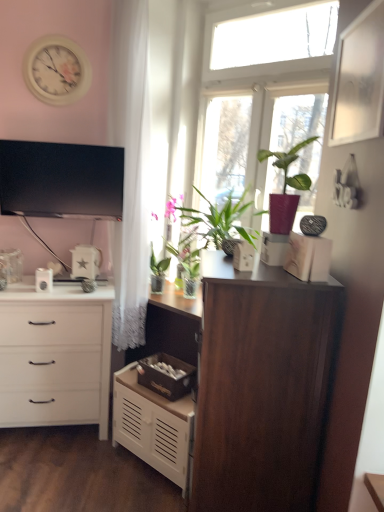
Question: Is white glossy star-shaped object at center, placed as the 2th appliance when sorted from right to left, in front of or behind white glossy toaster at center, which is the 1th appliance in front-to-back order, in the image?

Choices:
 (A) front
 (B) behind

Answer: (B)

Question: Considering the positions of white glossy star-shaped object at center, placed as the 2th appliance when sorted from right to left, and white glossy toaster at center, which is counted as the 1th appliance, starting from the right, in the image, is white glossy star-shaped object at center, placed as the 2th appliance when sorted from right to left, wider or thinner than white glossy toaster at center, which is counted as the 1th appliance, starting from the right,?

Choices:
 (A) thin
 (B) wide

Answer: (B)

Question: Which is farther from the clear glass window at upper center?

Choices:
 (A) black glossy tv at upper left
 (B) white glossy kettle at left, which is counted as the second appliance, starting from the front
 (C) white matte chest of drawers at lower center, which is the 1th chest of drawers in right-to-left order
 (D) brown wooden storage box at center, the 2th storage box from the front
 (E) white glossy star-shaped object at center, placed as the 2th appliance when sorted from right to left

Answer: (B)

Question: Based on their relative distances, which object is farther from the white glossy clock at upper left?

Choices:
 (A) black glossy tv at upper left
 (B) dark wood cupboard at center
 (C) white glossy star-shaped object at center, which is the second appliance in left-to-right order
 (D) white matte chest of drawers at left, which appears as the 2th chest of drawers when viewed from the right
 (E) white glossy kettle at left, which is counted as the second appliance, starting from the front

Answer: (B)